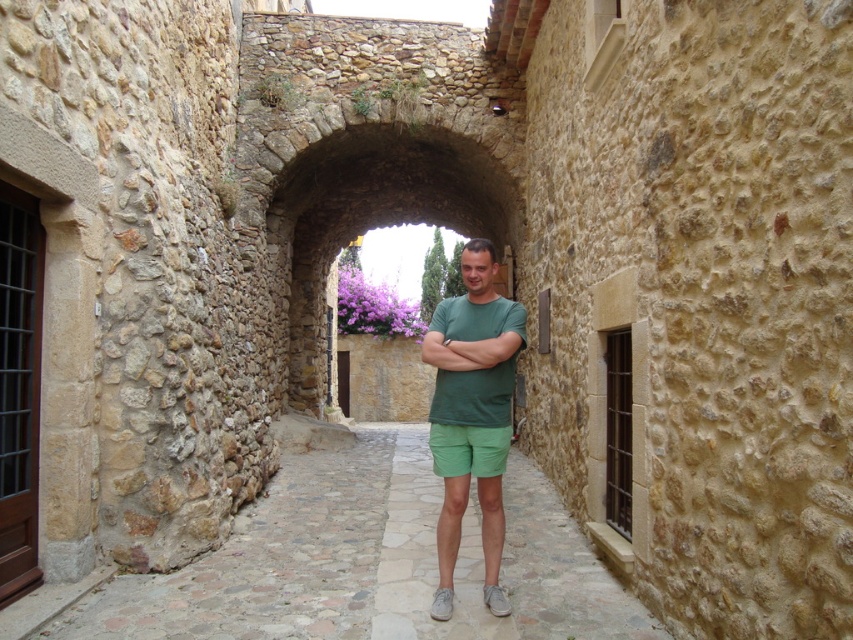
From the picture: You are standing in the narrow cobblestone alleyway and want to move from the point at coordinates point (383,458) to the point at coordinates point (450,339). Which direction should you move to get closer to your destination?

To move from point (383,458) to point (450,339), you should move away from the viewer since point (383,458) is closer to you than point (450,339).